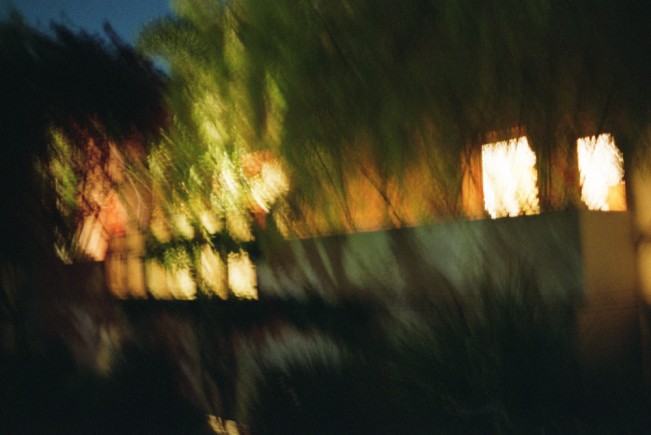
Find the location of `ledge`. ledge is located at coordinates (366, 265).